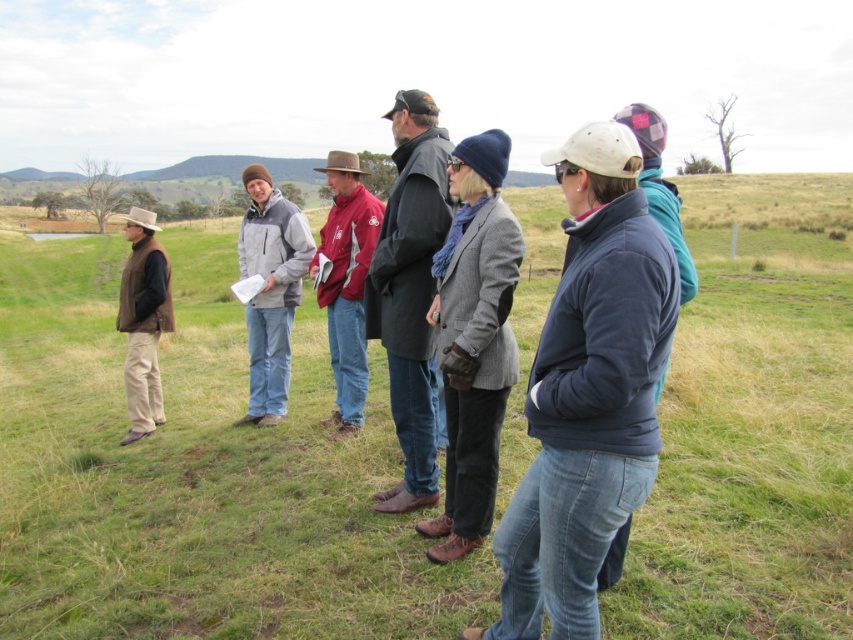
Consider the image. You are standing in the grassy field and want to find the blue jeans at center. According to the coordinates given, where should you look?

You should look at point 0.742 on the x axis and 0.229 on the y axis to find the blue jeans at center.

You are standing in the grassy field and need to locate the denim jacket at center. According to the coordinates provided, where exactly would you find it?

The denim jacket at center is located at coordinates point (x=589, y=392).